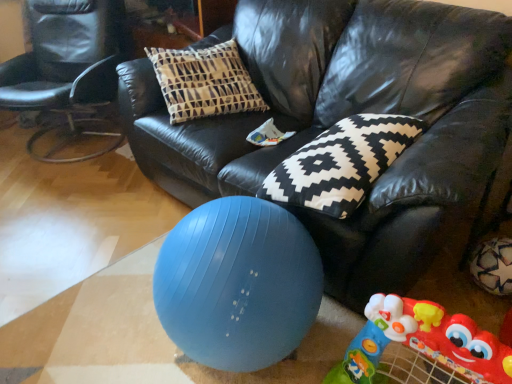
Question: Is point (97, 14) positioned closer to the camera than point (359, 102)?

Choices:
 (A) farther
 (B) closer

Answer: (A)

Question: In terms of width, does black leather chair at left look wider or thinner when compared to black leather couch at center?

Choices:
 (A) thin
 (B) wide

Answer: (A)

Question: Based on their relative distances, which object is nearer to the black leather chair at left?

Choices:
 (A) black and white patterned pillow at center
 (B) rubberized plastic walker at lower right
 (C) blue rubber ball at lower center
 (D) black leather couch at center

Answer: (D)

Question: Estimate the real-world distances between objects in this image. Which object is farther from the black and white patterned pillow at center?

Choices:
 (A) black leather couch at center
 (B) rubberized plastic walker at lower right
 (C) black leather chair at left
 (D) blue rubber ball at lower center

Answer: (C)